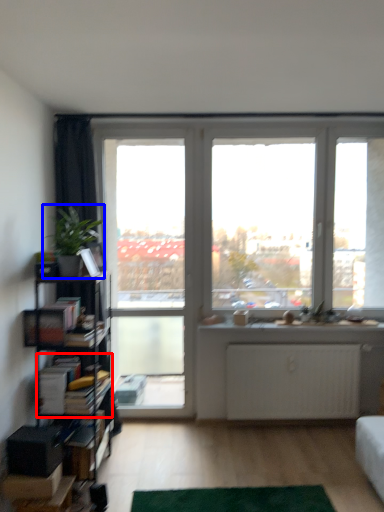
Question: Which point is further to the camera, book (highlighted by a red box) or houseplant (highlighted by a blue box)?

Choices:
 (A) book
 (B) houseplant

Answer: (A)